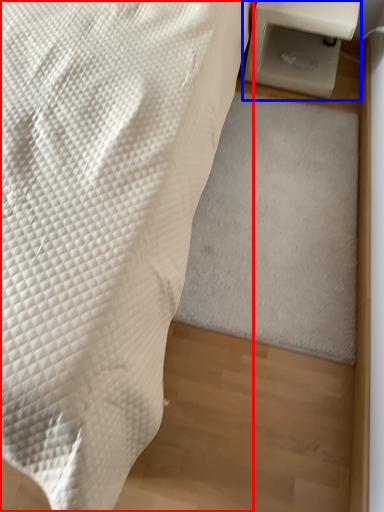
Question: Which of the following is the closest to the observer, furniture (highlighted by a red box) or table (highlighted by a blue box)?

Choices:
 (A) furniture
 (B) table

Answer: (A)